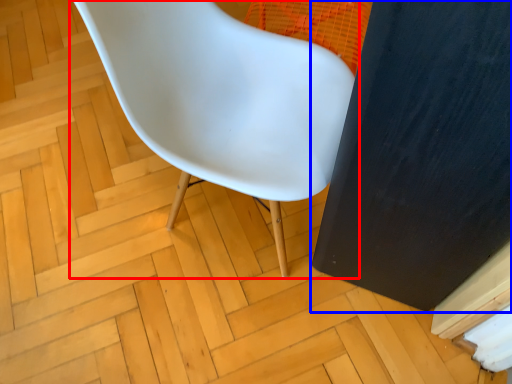
Question: Which object is further to the camera taking this photo, chair (highlighted by a red box) or screen door (highlighted by a blue box)?

Choices:
 (A) chair
 (B) screen door

Answer: (A)